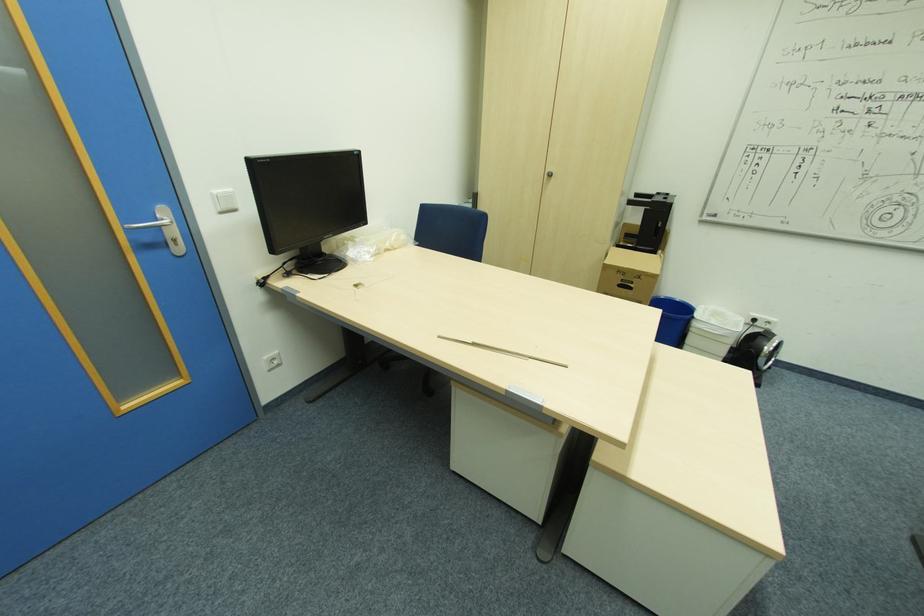
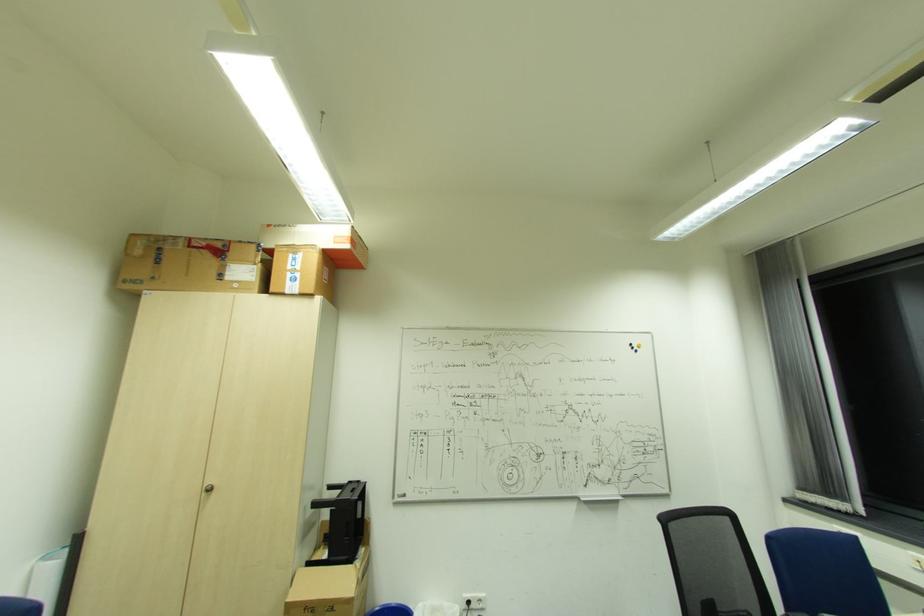
First-person continuous shooting, in which direction is the camera rotating?

The camera rotated toward right-up.